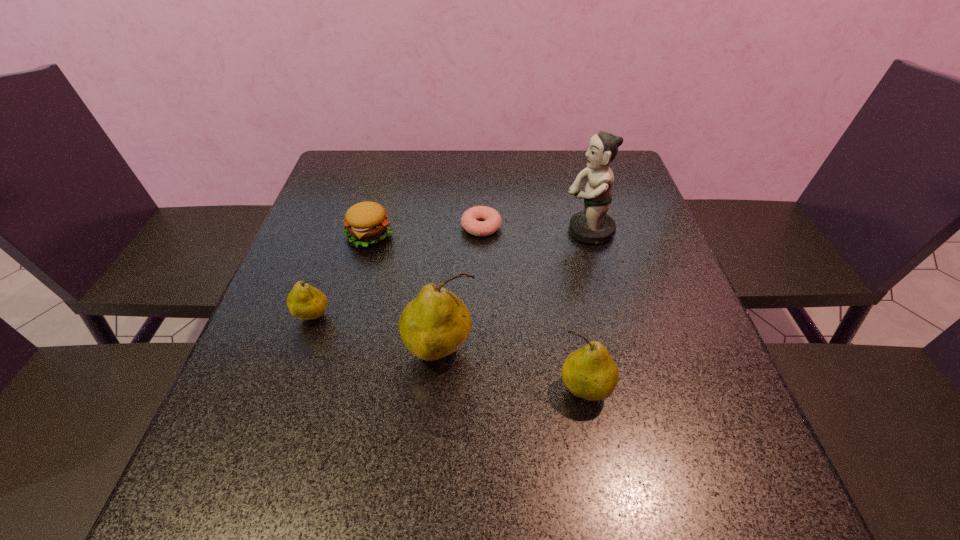
The width and height of the screenshot is (960, 540). I want to click on unoccupied area between the shortest pear and the fifth shortest object, so click(x=377, y=334).

The height and width of the screenshot is (540, 960). In order to click on free area in between the second tallest pear and the figurine in this screenshot , I will do `click(586, 310)`.

Locate an element on the screen. This screenshot has height=540, width=960. vacant space that's between the second pear from left to right and the fifth tallest object is located at coordinates (404, 293).

Locate which object ranks in proximity to the fifth tallest object. Please provide its 2D coordinates. Your answer should be formatted as a tuple, i.e. [(x, y)], where the tuple contains the x and y coordinates of a point satisfying the conditions above.

[(470, 219)]

Point out which object is positioned as the second nearest to the second tallest pear. Please provide its 2D coordinates. Your answer should be formatted as a tuple, i.e. [(x, y)], where the tuple contains the x and y coordinates of a point satisfying the conditions above.

[(593, 225)]

Where is `the second closest pear to the second shortest object`? The image size is (960, 540). the second closest pear to the second shortest object is located at coordinates (436, 323).

Select which pear appears as the third closest to the shortest object. Please provide its 2D coordinates. Your answer should be formatted as a tuple, i.e. [(x, y)], where the tuple contains the x and y coordinates of a point satisfying the conditions above.

[(590, 373)]

The height and width of the screenshot is (540, 960). What are the coordinates of `free location that satisfies the following two spatial constraints: 1. on the front side of the second tallest pear; 2. on the left side of the second shortest object` in the screenshot? It's located at (326, 390).

Identify the location of free spot that satisfies the following two spatial constraints: 1. on the front side of the second tallest pear; 2. on the right side of the shortest pear. This screenshot has height=540, width=960. (289, 390).

Find the location of a particular element. The height and width of the screenshot is (540, 960). free space in the image that satisfies the following two spatial constraints: 1. on the front-facing side of the figurine; 2. on the front side of the rightmost pear is located at coordinates (631, 390).